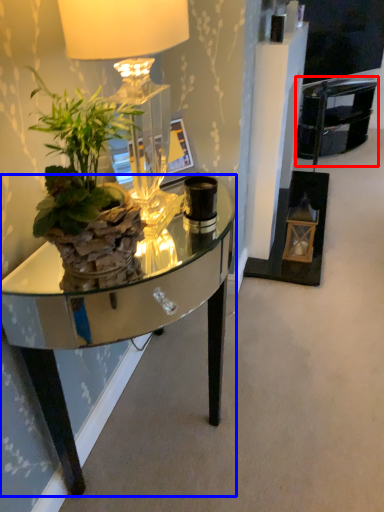
Question: Which object appears farthest to the camera in this image, armchair (highlighted by a red box) or desk (highlighted by a blue box)?

Choices:
 (A) armchair
 (B) desk

Answer: (A)